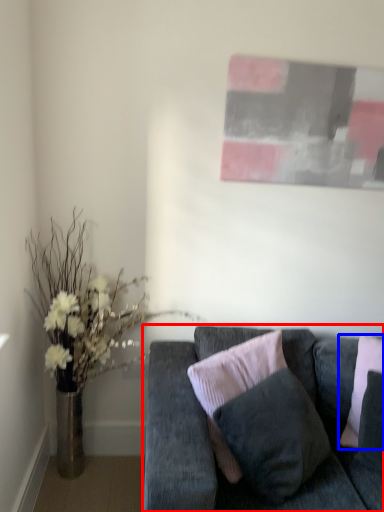
Question: Among these objects, which one is farthest to the camera, studio couch (highlighted by a red box) or pillow (highlighted by a blue box)?

Choices:
 (A) studio couch
 (B) pillow

Answer: (B)